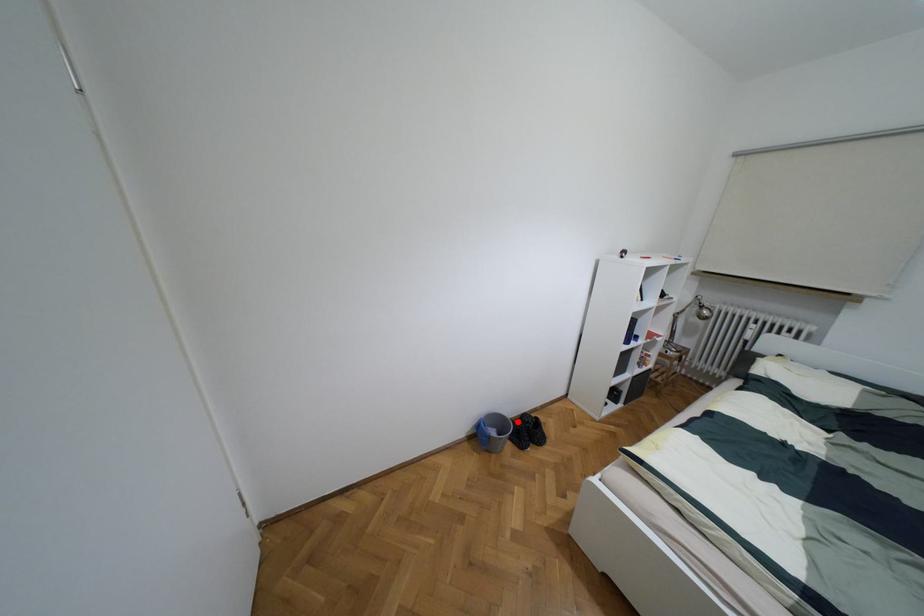
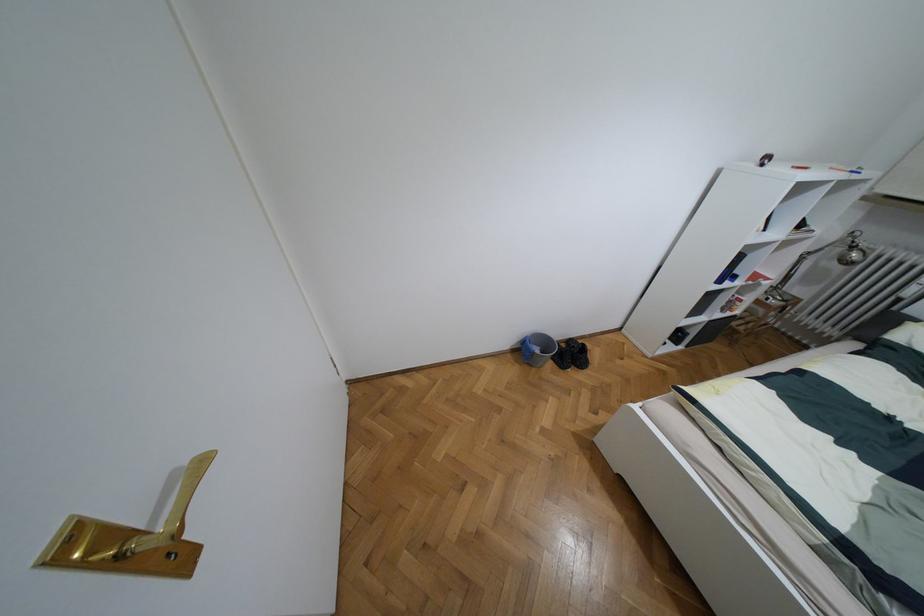
Question: I am providing you with two images of the same scene from different viewpoints. A red point is marked on the first image. Is the red point's position out of view in image 2?

Choices:
 (A) Yes
 (B) No

Answer: (B)